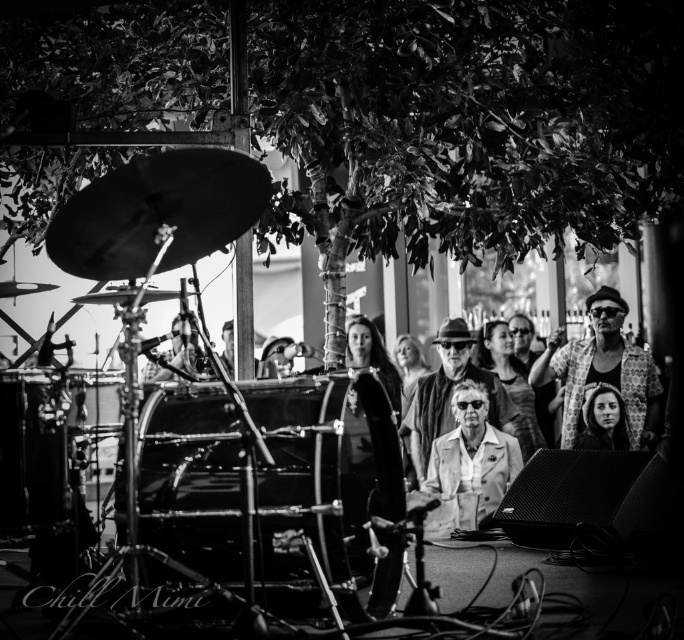
Who is more forward, (605, 355) or (451, 324)?

Point (605, 355) is more forward.

Can you confirm if patterned fabric jacket at center is taller than light beige leather jacket at center?

In fact, patterned fabric jacket at center may be shorter than light beige leather jacket at center.

Who is more forward, (588, 372) or (445, 422)?

Positioned in front is point (588, 372).

In order to click on patterned fabric jacket at center in this screenshot , I will do `click(603, 371)`.

Is shiny metallic drum at lower left wider than matte beige coat at center?

No, shiny metallic drum at lower left is not wider than matte beige coat at center.

Based on the photo, can you confirm if shiny metallic drum at lower left is thinner than matte beige coat at center?

Yes.

Is point (0, 456) in front of point (516, 445)?

Yes.

You are a GUI agent. You are given a task and a screenshot of the screen. Output one action in this format:
    pyautogui.click(x=<x>, y=<y>)
    Task: Click on the shiny metallic drum at lower left
    This screenshot has height=640, width=684.
    Given the screenshot: What is the action you would take?
    pyautogui.click(x=31, y=451)

Consider the image. Is patterned fabric jacket at center further to camera compared to smooth skin face at lower center?

Yes.

Which is above, patterned fabric jacket at center or smooth skin face at lower center?

patterned fabric jacket at center is higher up.

The height and width of the screenshot is (640, 684). What do you see at coordinates (603, 371) in the screenshot? I see `patterned fabric jacket at center` at bounding box center [603, 371].

This screenshot has width=684, height=640. I want to click on patterned fabric jacket at center, so click(x=603, y=371).